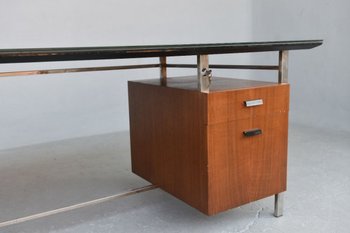
Identify the location of white floor. (320, 180).